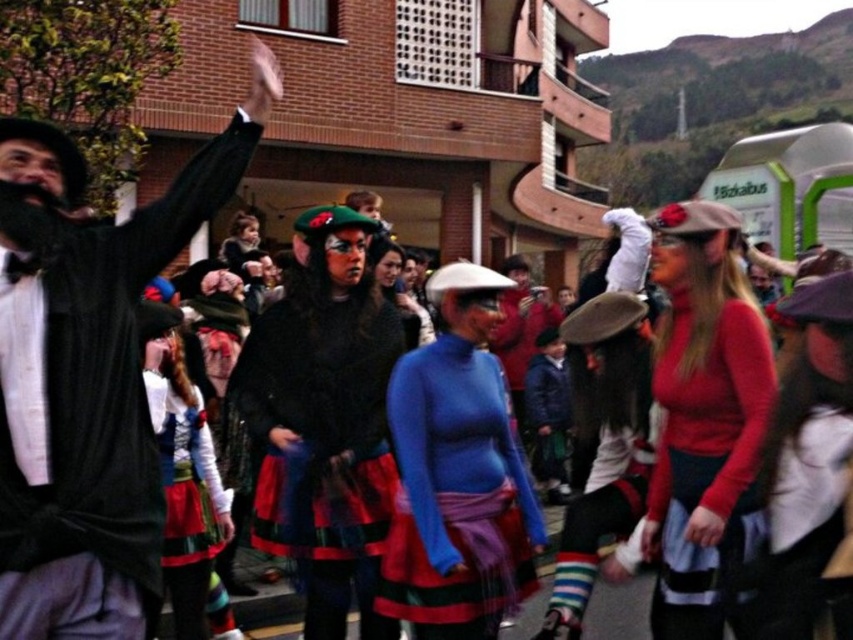
Question: Is matte black coat at left further to the viewer compared to blue turtleneck sweater at center?

Choices:
 (A) yes
 (B) no

Answer: (B)

Question: Is matte black coat at left closer to camera compared to velvet black dress at center?

Choices:
 (A) no
 (B) yes

Answer: (B)

Question: Estimate the real-world distances between objects in this image. Which object is closer to the matte black coat at left?

Choices:
 (A) blue turtleneck sweater at center
 (B) velvet black dress at center
 (C) red matte sweater at center

Answer: (B)

Question: Which of these objects is positioned farthest from the red matte sweater at center?

Choices:
 (A) velvet black dress at center
 (B) matte black coat at left
 (C) blue turtleneck sweater at center
 (D) multicolored fabric skirt at center

Answer: (B)

Question: Which object is the farthest from the multicolored fabric skirt at center?

Choices:
 (A) matte black coat at left
 (B) blue turtleneck sweater at center
 (C) red matte sweater at center

Answer: (C)

Question: Can you confirm if blue turtleneck sweater at center is positioned to the right of multicolored fabric skirt at center?

Choices:
 (A) yes
 (B) no

Answer: (A)